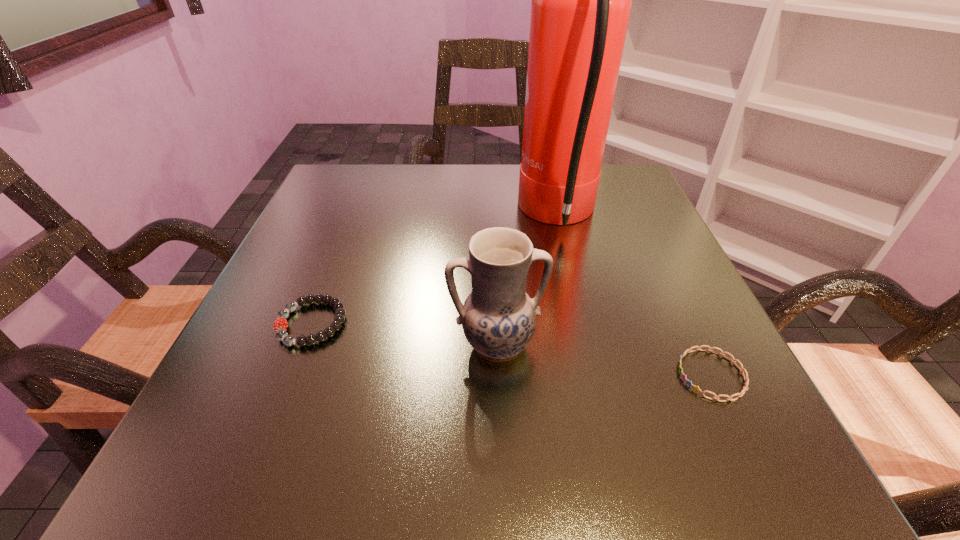
I want to click on the tallest object, so (x=581, y=0).

Identify the location of fire extinguisher. (581, 0).

You are a GUI agent. You are given a task and a screenshot of the screen. Output one action in this format:
    pyautogui.click(x=<x>, y=<y>)
    Task: Click on the second tallest object
    
    Given the screenshot: What is the action you would take?
    coord(498,317)

Locate an element on the screen. the left bracelet is located at coordinates (280, 325).

This screenshot has width=960, height=540. I want to click on the leftmost object, so click(x=280, y=325).

Find the location of `the nearer bracelet`. the nearer bracelet is located at coordinates (696, 388).

Where is `the rightmost object`? The width and height of the screenshot is (960, 540). the rightmost object is located at coordinates (696, 388).

Identify the location of blank space located 0.390m towards the nozzle of the fire extinguisher. Image resolution: width=960 pixels, height=540 pixels. (333, 216).

You are a GUI agent. You are given a task and a screenshot of the screen. Output one action in this format:
    pyautogui.click(x=<x>, y=<y>)
    Task: Click on the vacant space located towards the nozzle of the fire extinguisher
    The image size is (960, 540).
    Given the screenshot: What is the action you would take?
    pyautogui.click(x=376, y=216)

This screenshot has width=960, height=540. In order to click on free space located 0.370m towards the nozzle of the fire extinguisher in this screenshot , I will do `click(343, 216)`.